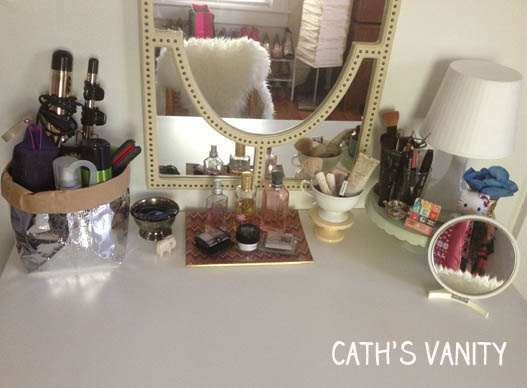
Locate an element on the screen. mirror is located at coordinates (491, 255).